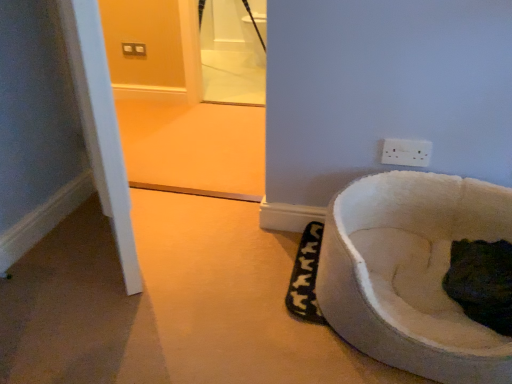
Locate an element on the screen. The width and height of the screenshot is (512, 384). vacant space positioned to the left of dark fur cat at lower right is located at coordinates (410, 276).